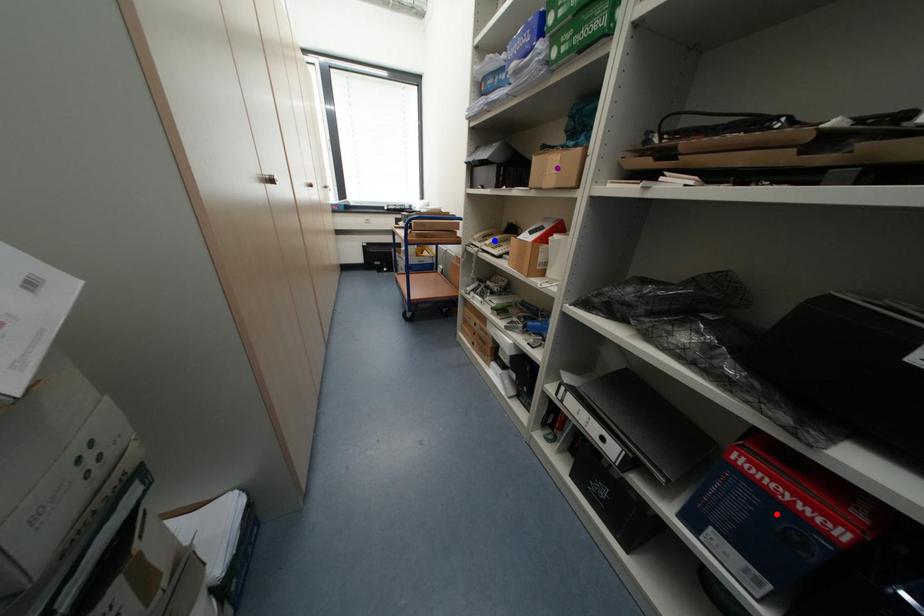
Order these from nearest to farthest:
purple point
red point
blue point

1. red point
2. purple point
3. blue point